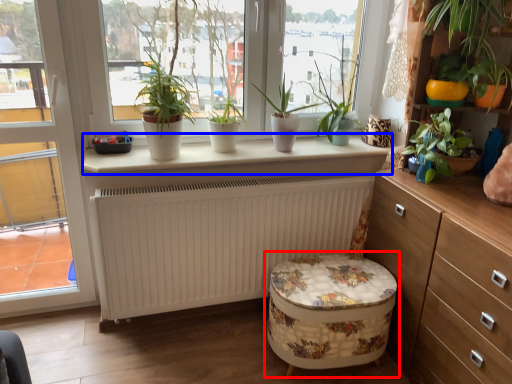
Question: Which object is closer to the camera taking this photo, swivel chair (highlighted by a red box) or window sill (highlighted by a blue box)?

Choices:
 (A) swivel chair
 (B) window sill

Answer: (A)